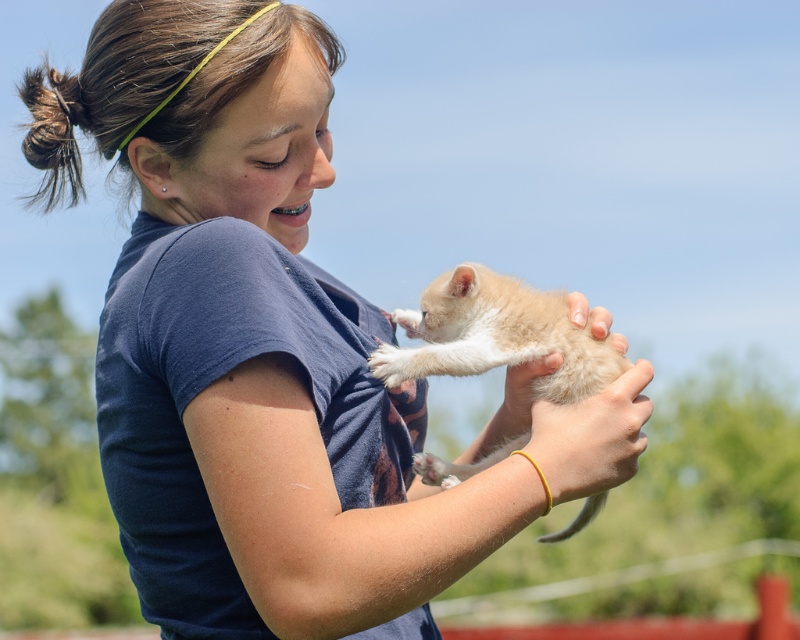
You are a photographer observing the scene. You notice the soft fur paw at center and the white fluffy paw at upper center. Which paw is closer to the camera?

The soft fur paw at center is closer to the camera because the white fluffy paw at upper center is behind it.

You are a photographer trying to capture the interaction between the smooth skin hand at center and the soft fur paw at center. To ensure both are clearly visible in the photo, which object should you focus on first considering their sizes?

The smooth skin hand at center is wider than the soft fur paw at center, so focusing on the smooth skin hand at center first would ensure both are in focus since it is larger.

You are standing in a park and see a young woman holding a kitten. There is a specific point in the scene at coordinates point (512, 428). If you want to reach that point without moving closer than 6 feet to the woman, can you do it?

The point (512, 428) is 6.15 feet away from the viewer, so yes, you can reach it without moving closer than 6 feet to the woman since the distance is slightly more than 6 feet.